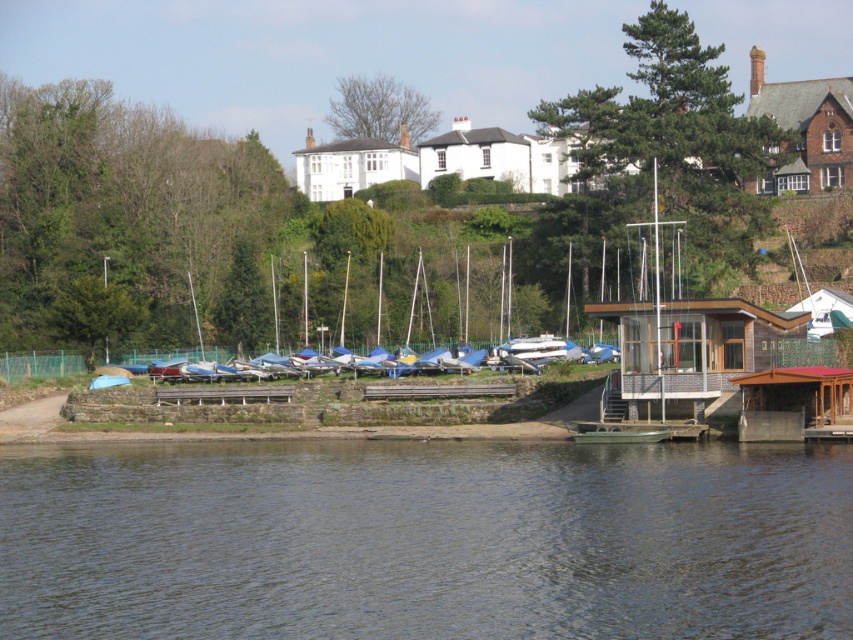
You are a visitor at the riverside and want to board the green rubber boat at lower center. Which side of the brown wooden dock at lower right should you approach from?

You should approach from the left side of the brown wooden dock at lower right because the green rubber boat at lower center is positioned on the left side of it.

You are a boat operator who needs to move a 70 feet long cargo barge from the green rubber boat at lower center to the brown wooden dock at lower right. Can you safely maneuver the cargo barge between them without any part of it overlapping?

The distance between the green rubber boat at lower center and the brown wooden dock at lower right is 69.86 feet. Since the cargo barge is 70 feet long, it would require at least 70 feet of space to maneuver without overlapping. Therefore, the cargo barge cannot be safely moved between them as there is insufficient space.